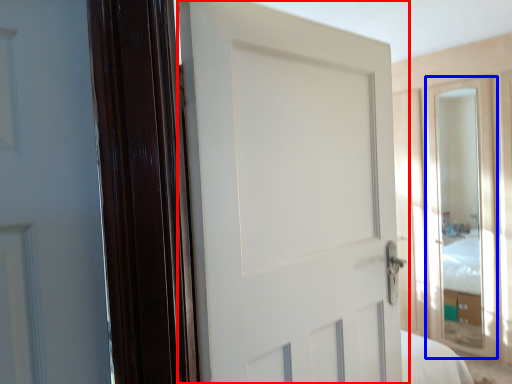
Question: Which of the following is the closest to the observer, door (highlighted by a red box) or glass door (highlighted by a blue box)?

Choices:
 (A) door
 (B) glass door

Answer: (A)